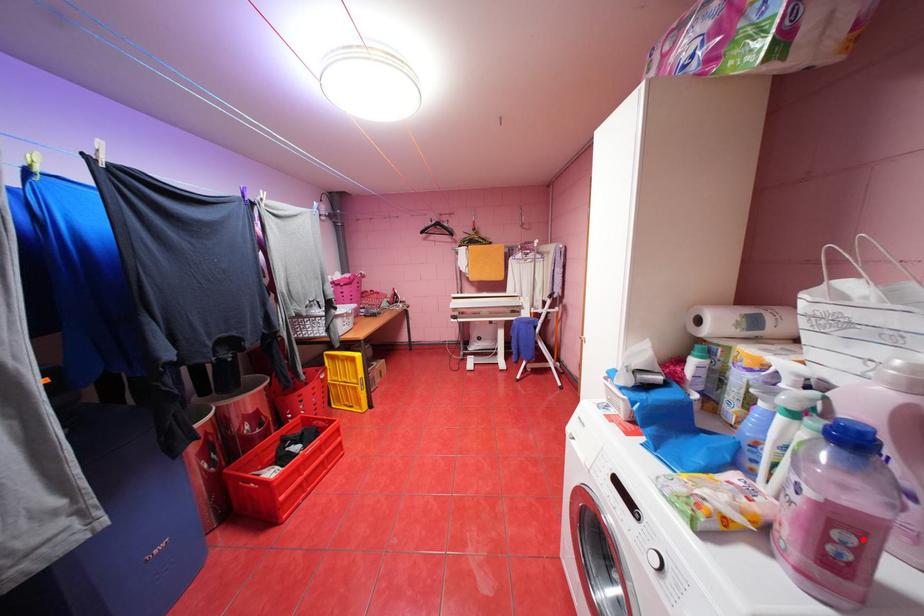
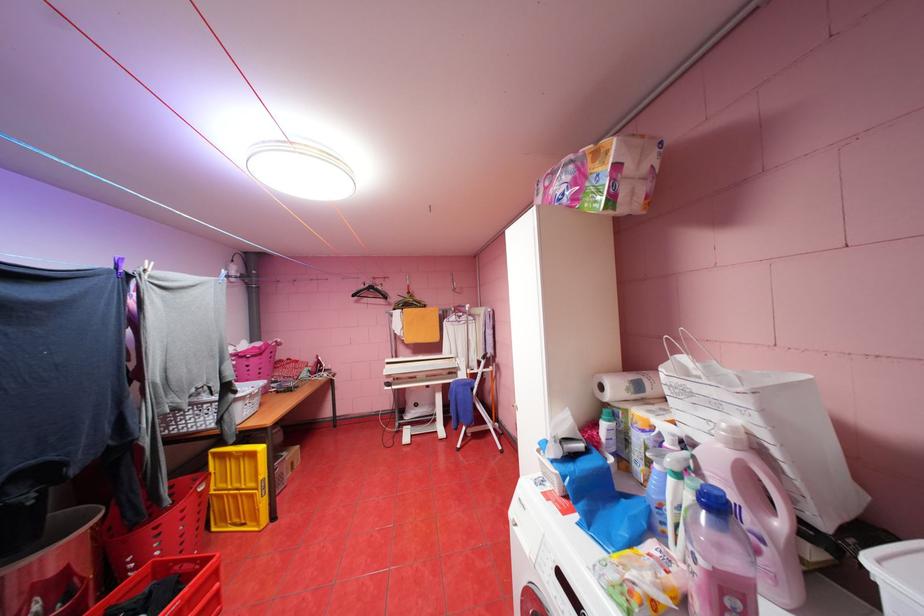
The point at the highlighted location is marked in the first image. Where is the corresponding point in the second image?

(748, 604)